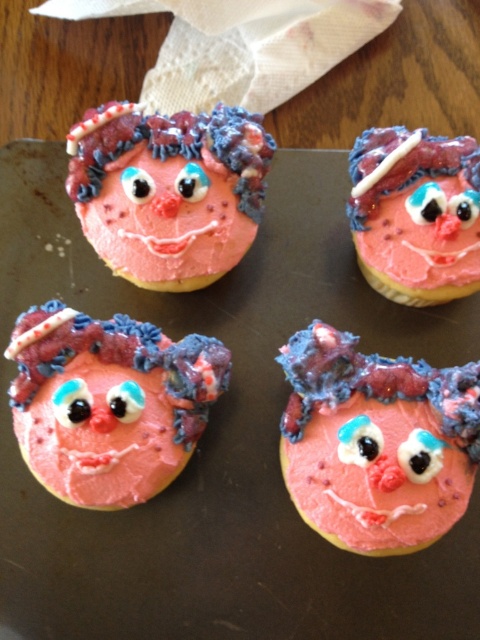
Question: Based on their relative distances, which object is nearer to the pink matte cookie at upper right?

Choices:
 (A) pink matte cookie at center
 (B) pink matte cookie at upper left

Answer: (B)

Question: Is pink matte cookie at lower left smaller than pink matte cookie at upper left?

Choices:
 (A) yes
 (B) no

Answer: (B)

Question: Can you confirm if pink matte cookie at center is positioned above pink matte cookie at lower left?

Choices:
 (A) no
 (B) yes

Answer: (A)

Question: Among these objects, which one is nearest to the camera?

Choices:
 (A) pink matte cookie at upper right
 (B) pink matte cookie at center
 (C) pink matte cookie at lower left
 (D) pink matte cookie at upper left

Answer: (B)

Question: Which point is closer to the camera?

Choices:
 (A) pink matte cookie at center
 (B) pink matte cookie at upper left
 (C) pink matte cookie at lower left

Answer: (A)

Question: In this image, where is pink matte cookie at upper left located relative to pink matte cookie at upper right?

Choices:
 (A) below
 (B) above

Answer: (B)